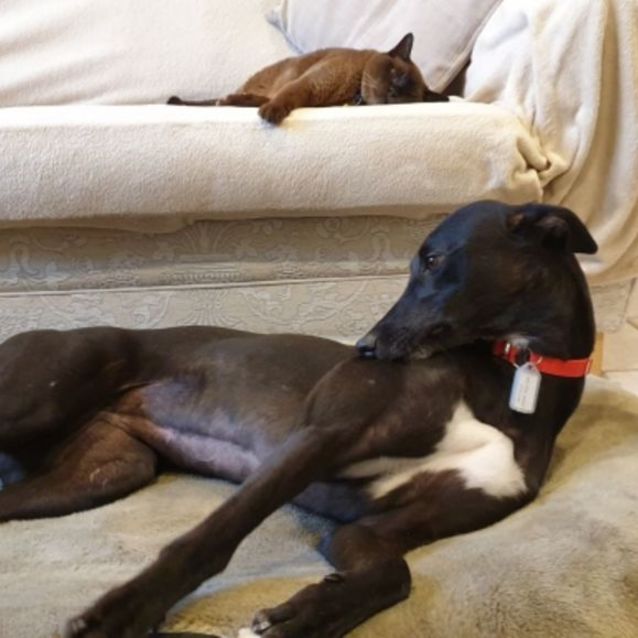
This screenshot has width=638, height=638. Identify the location of white pillow. (433, 32).